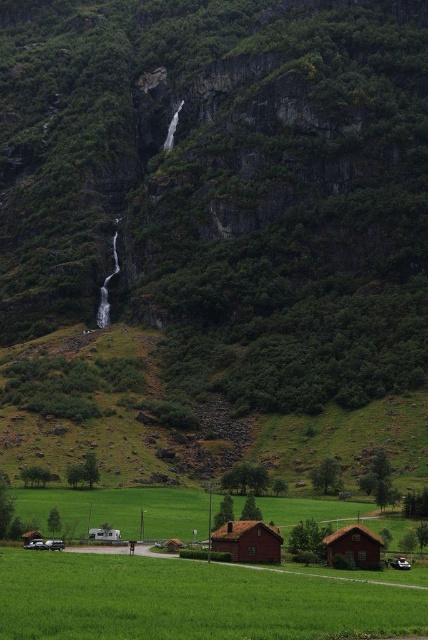
Question: Is green grass field at lower center bigger than matte red wooden hut at center?

Choices:
 (A) no
 (B) yes

Answer: (B)

Question: Does green grass field at lower center appear on the right side of matte red wooden hut at center?

Choices:
 (A) yes
 (B) no

Answer: (B)

Question: Considering the real-world distances, which object is farthest from the matte red wooden hut at center?

Choices:
 (A) brown wooden hut at lower right
 (B) green grass field at lower center

Answer: (B)

Question: Can you confirm if matte red wooden hut at center is positioned to the right of brown wooden hut at lower right?

Choices:
 (A) yes
 (B) no

Answer: (B)

Question: Which object is the closest to the matte red wooden hut at center?

Choices:
 (A) green grass field at lower center
 (B) brown wooden hut at lower right

Answer: (B)

Question: Among these objects, which one is nearest to the camera?

Choices:
 (A) brown wooden hut at lower right
 (B) green grass field at lower center
 (C) matte red wooden hut at center

Answer: (B)